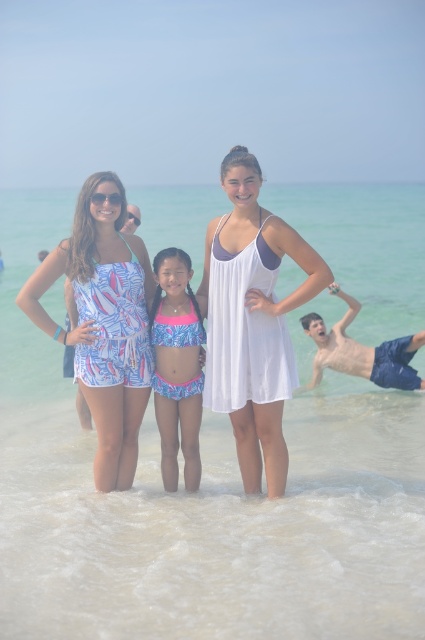
In the scene shown: Can you confirm if clear water at center is taller than pink lycra bikini at center?

Yes.

Between clear water at center and pink lycra bikini at center, which one is positioned higher?

clear water at center is above.

Between point (59, 608) and point (166, 412), which one is positioned in front?

Point (59, 608) is in front.

At what (x,y) coordinates should I click in order to perform the action: click on clear water at center. Please return your answer as a coordinate pair (x, y). The height and width of the screenshot is (640, 425). Looking at the image, I should click on (198, 502).

Which is above, white sheer dress at center or pink lycra bikini at center?

white sheer dress at center is above.

Can you confirm if white sheer dress at center is wider than pink lycra bikini at center?

Yes, white sheer dress at center is wider than pink lycra bikini at center.

Image resolution: width=425 pixels, height=640 pixels. What do you see at coordinates (252, 321) in the screenshot?
I see `white sheer dress at center` at bounding box center [252, 321].

Where is `white sheer dress at center`? The width and height of the screenshot is (425, 640). white sheer dress at center is located at coordinates (252, 321).

Is point (13, 600) behind point (229, 212)?

That is False.

Between clear water at center and white sheer dress at center, which one is positioned lower?

white sheer dress at center is below.

What do you see at coordinates (198, 502) in the screenshot?
I see `clear water at center` at bounding box center [198, 502].

Image resolution: width=425 pixels, height=640 pixels. Find the location of `clear water at center`. clear water at center is located at coordinates (198, 502).